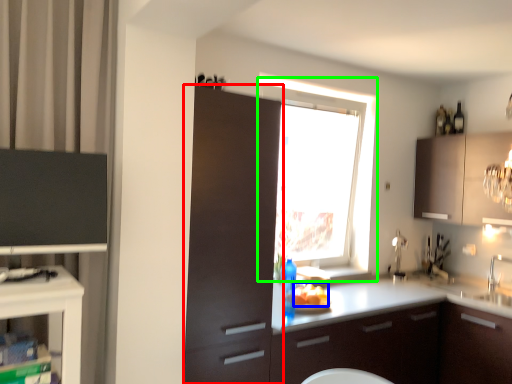
Question: Which object is positioned farthest from cabinetry (highlighted by a red box)? Select from food (highlighted by a blue box) and window (highlighted by a green box).

Choices:
 (A) food
 (B) window

Answer: (B)